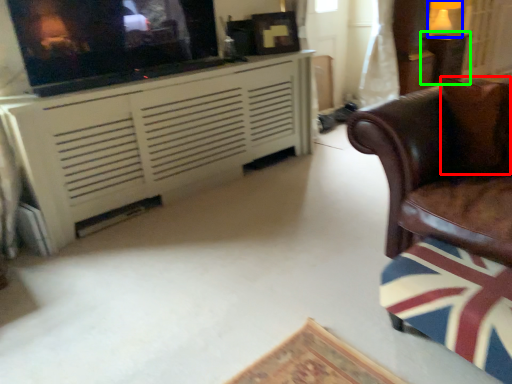
Question: Based on their relative distances, which object is nearer to pillow (highlighted by a red box)? Choose from lamp (highlighted by a blue box) and table (highlighted by a green box).

Choices:
 (A) lamp
 (B) table

Answer: (B)